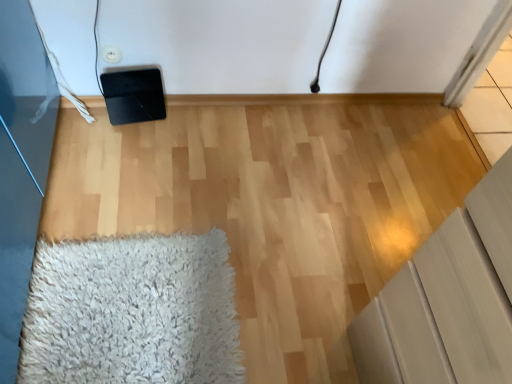
Question: Based on their sizes in the image, would you say white shaggy rug at lower left is bigger or smaller than matte gray cabinet at lower right?

Choices:
 (A) big
 (B) small

Answer: (B)

Question: From the image's perspective, is white shaggy rug at lower left positioned above or below matte gray cabinet at lower right?

Choices:
 (A) above
 (B) below

Answer: (B)

Question: Which is correct: white shaggy rug at lower left is inside matte gray cabinet at lower right, or outside of it?

Choices:
 (A) inside
 (B) outside

Answer: (B)

Question: From their relative heights in the image, would you say matte gray cabinet at lower right is taller or shorter than white shaggy rug at lower left?

Choices:
 (A) short
 (B) tall

Answer: (B)

Question: From the image's perspective, is matte gray cabinet at lower right positioned above or below white shaggy rug at lower left?

Choices:
 (A) above
 (B) below

Answer: (A)

Question: Is matte gray cabinet at lower right wider or thinner than white shaggy rug at lower left?

Choices:
 (A) thin
 (B) wide

Answer: (A)

Question: Considering their positions, is matte gray cabinet at lower right located in front of or behind white shaggy rug at lower left?

Choices:
 (A) front
 (B) behind

Answer: (A)